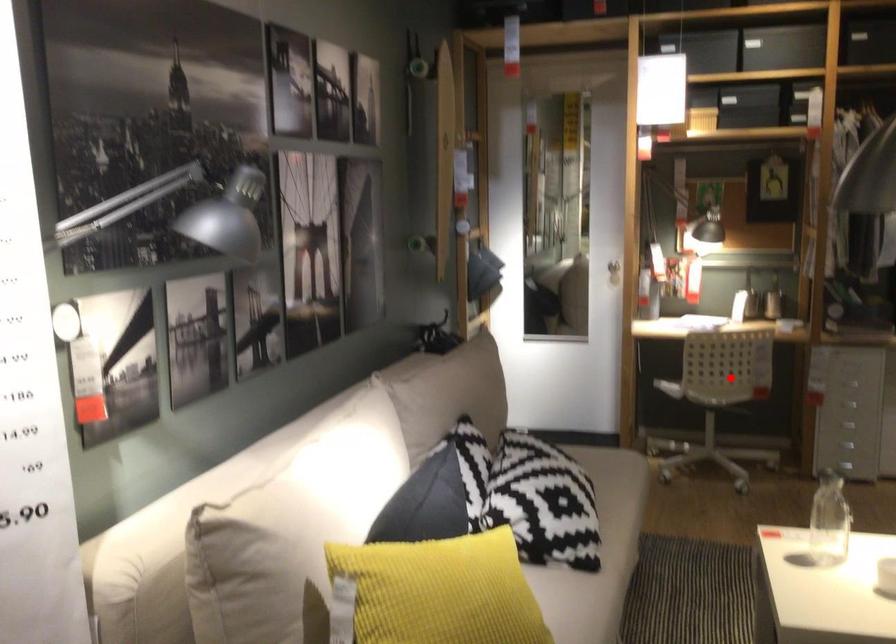
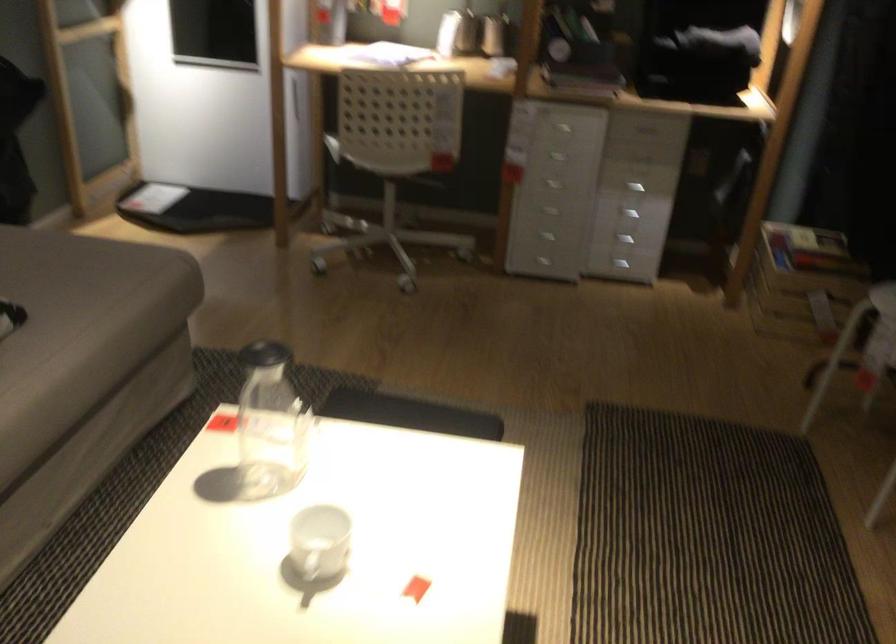
Question: I am providing you with two images of the same scene from different viewpoints. Given a red point in image1, look at the same physical point in image2. Is it:

Choices:
 (A) Closer to the viewpoint
 (B) Farther from the viewpoint

Answer: (A)